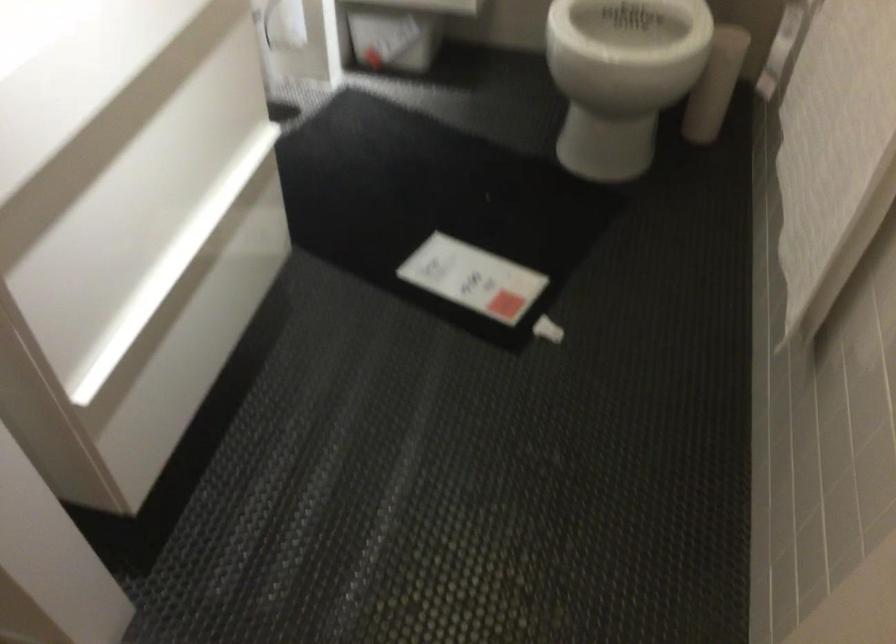
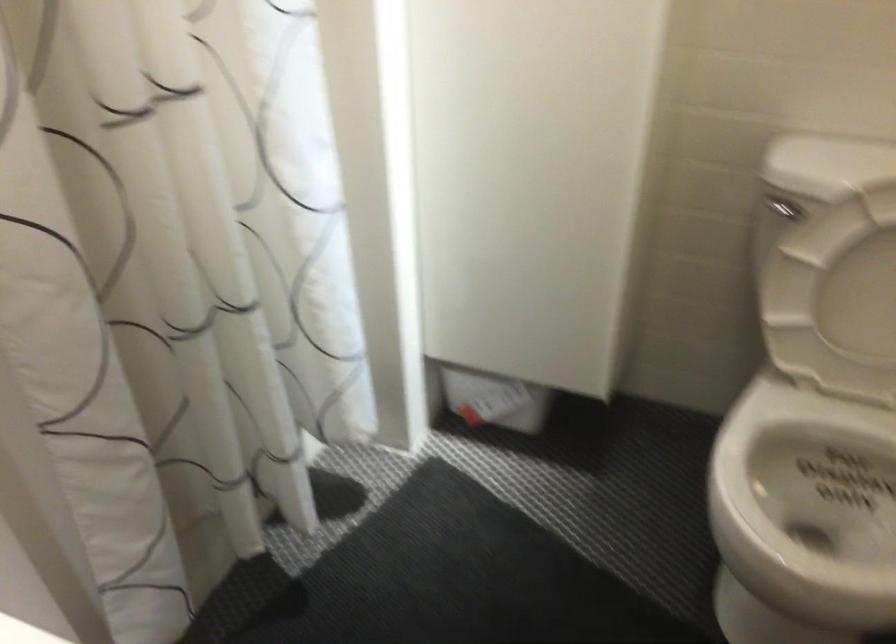
Question: Based on the continuous images, in which direction is the camera rotating? Reply with the corresponding letter.

Choices:
 (A) Left
 (B) Right
 (C) Up
 (D) Down

Answer: (C)